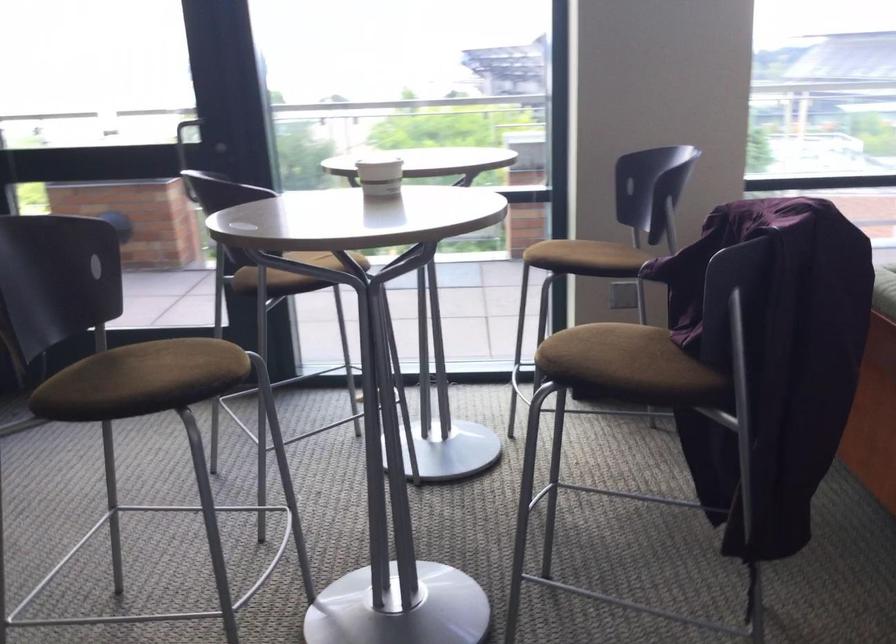
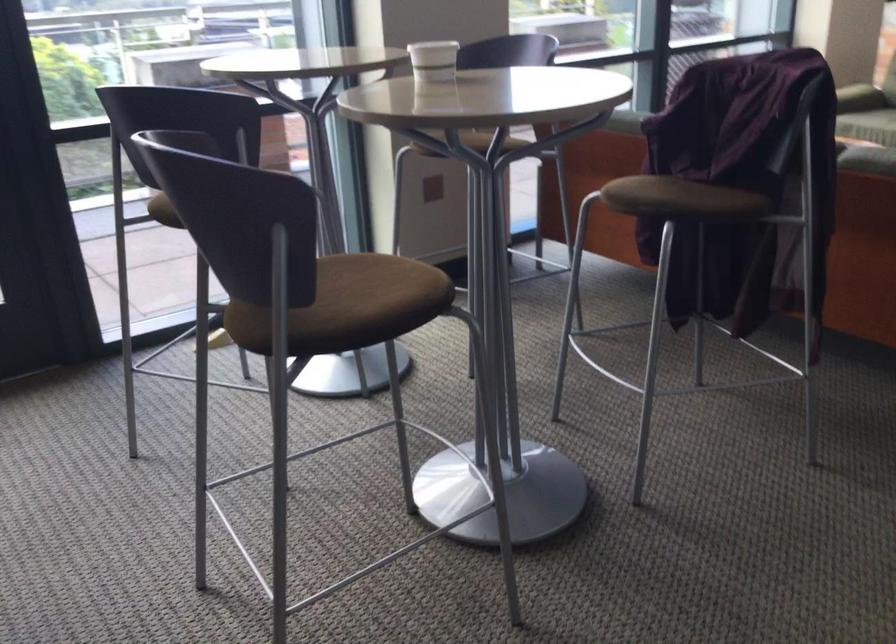
Find the pixel in the second image that matches (581,368) in the first image.

(666, 198)